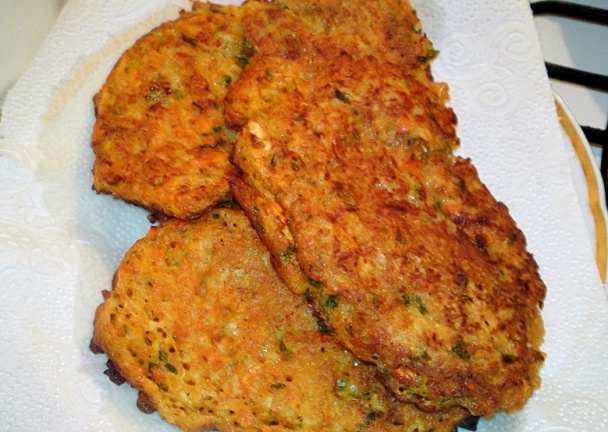
The width and height of the screenshot is (608, 432). In order to click on white paper towel in this screenshot , I will do `click(520, 175)`.